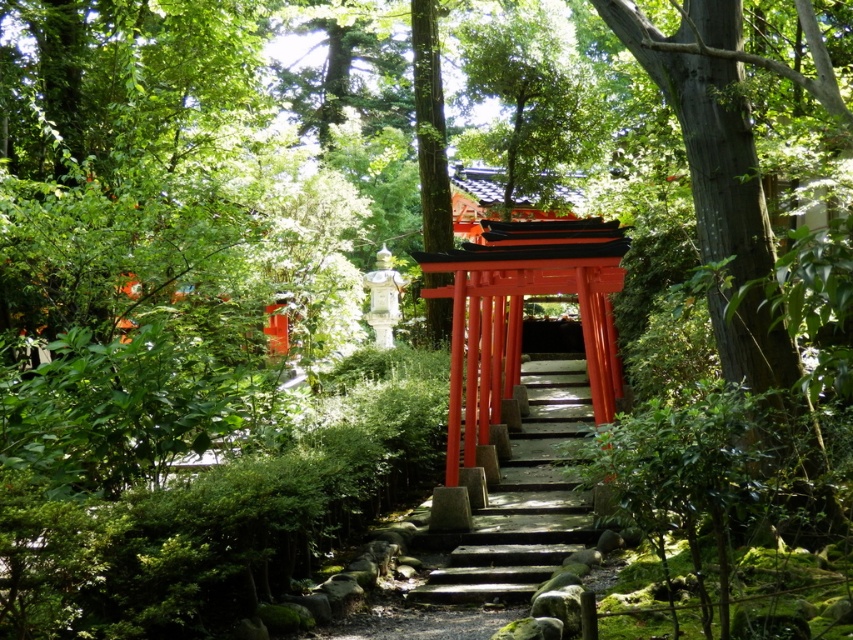
You are standing at the center of the torii gate in the Japanese garden. Looking towards the right side of the image, you notice a point marked at coordinates [717,173]. What object is located at this specific coordinate?

The point at coordinates [717,173] corresponds to the smooth bark tree at right.

You are standing at the center of the torii gate in the Japanese garden. Looking towards the right side of the scene, where would you find the smooth bark tree at right?

The smooth bark tree at right is located at the coordinates point (717, 173).

You are a visitor standing at the entrance of the garden and want to take a photo of the smooth bark tree at right. If your camera has a maximum zoom range of 10 meters, will you be able to capture the tree clearly without moving closer?

The smooth bark tree at right is 12.20 meters from the viewer. Since the camera can only zoom up to 10 meters, you will not be able to capture the tree clearly without moving closer.